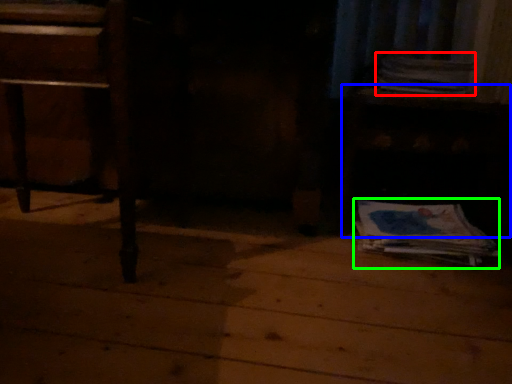
Question: Which object is positioned farthest from paperback book (highlighted by a red box)? Select from table (highlighted by a blue box) and paperback book (highlighted by a green box).

Choices:
 (A) table
 (B) paperback book

Answer: (B)